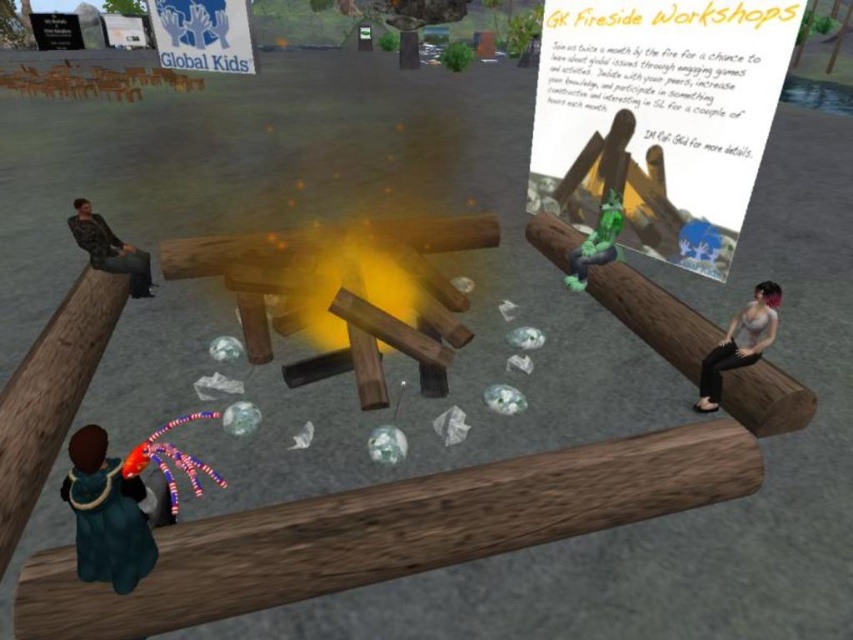
Question: Which of the following is the farthest from the observer?

Choices:
 (A) green rubber figure at center
 (B) brown wood log at right
 (C) brown wood beam at lower center

Answer: (A)

Question: Which object is closer to the camera taking this photo?

Choices:
 (A) green rubber figure at center
 (B) brown wood log at right

Answer: (B)

Question: Which object is farther from the camera taking this photo?

Choices:
 (A) white matte shirt at center
 (B) brown wood log at right
 (C) leather jacket at left
 (D) green woolen coat at lower left

Answer: (C)

Question: Is brown wood beam at lower center to the right of green woolen coat at lower left from the viewer's perspective?

Choices:
 (A) yes
 (B) no

Answer: (A)

Question: Is brown wood beam at lower left above brown wood log at right?

Choices:
 (A) no
 (B) yes

Answer: (A)

Question: Is leather jacket at left further to camera compared to green rubber figure at center?

Choices:
 (A) yes
 (B) no

Answer: (B)